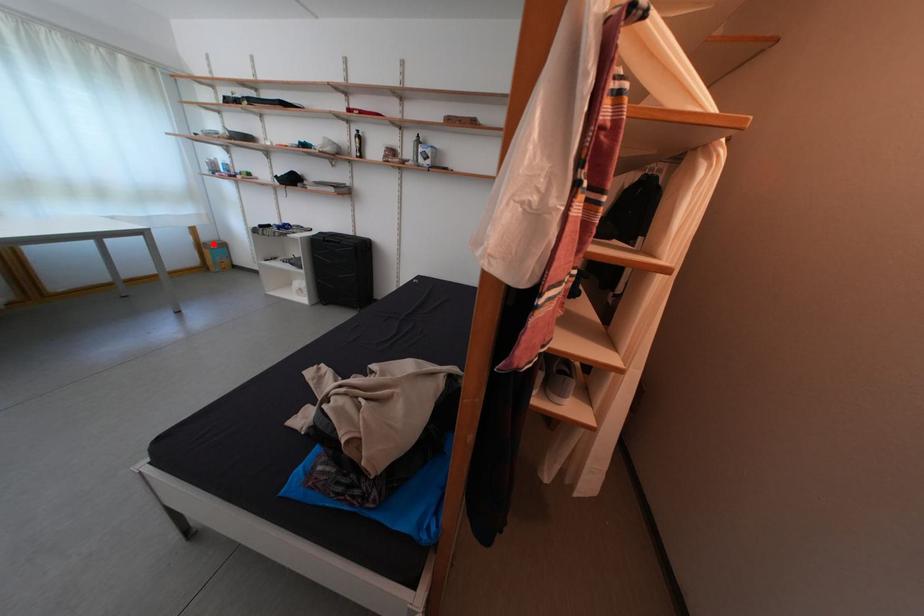
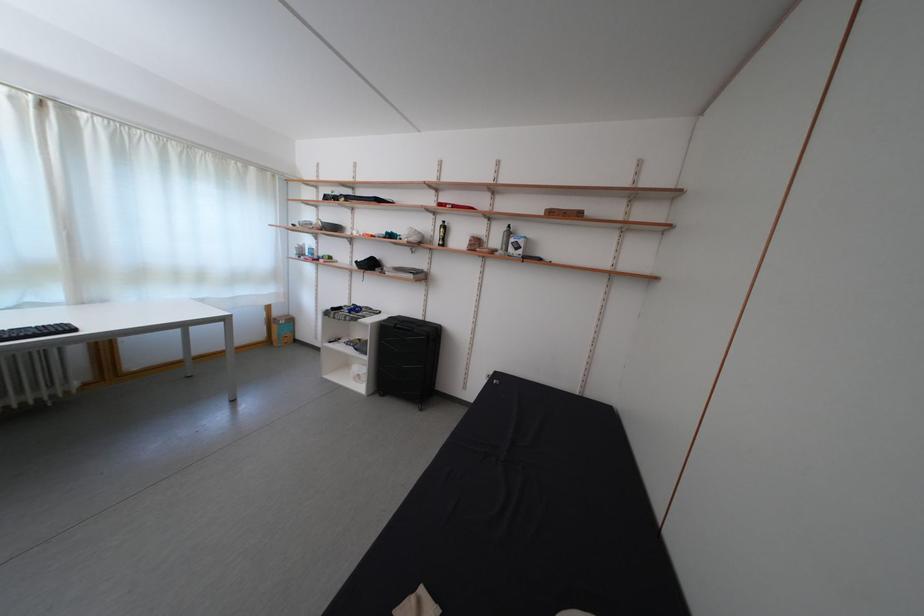
The point at the highlighted location is marked in the first image. Where is the corresponding point in the second image?

(285, 320)